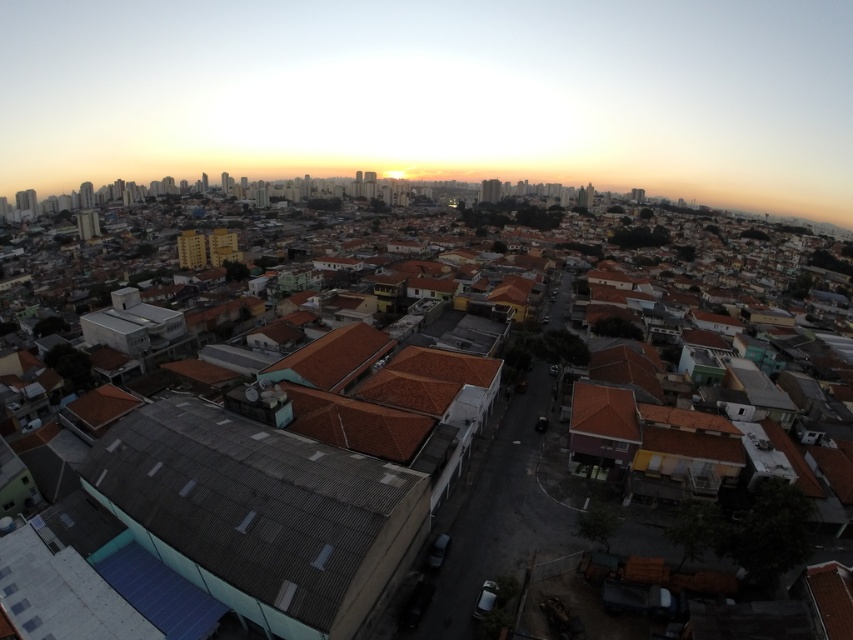
Can you confirm if brown tile roof at center is positioned to the right of gray corrugated metal roof at lower left?

Correct, you'll find brown tile roof at center to the right of gray corrugated metal roof at lower left.

The height and width of the screenshot is (640, 853). Identify the location of brown tile roof at center. (277, 484).

The width and height of the screenshot is (853, 640). What do you see at coordinates (277, 484) in the screenshot?
I see `brown tile roof at center` at bounding box center [277, 484].

At what (x,y) coordinates should I click in order to perform the action: click on brown tile roof at center. Please return your answer as a coordinate pair (x, y). Looking at the image, I should click on (277, 484).